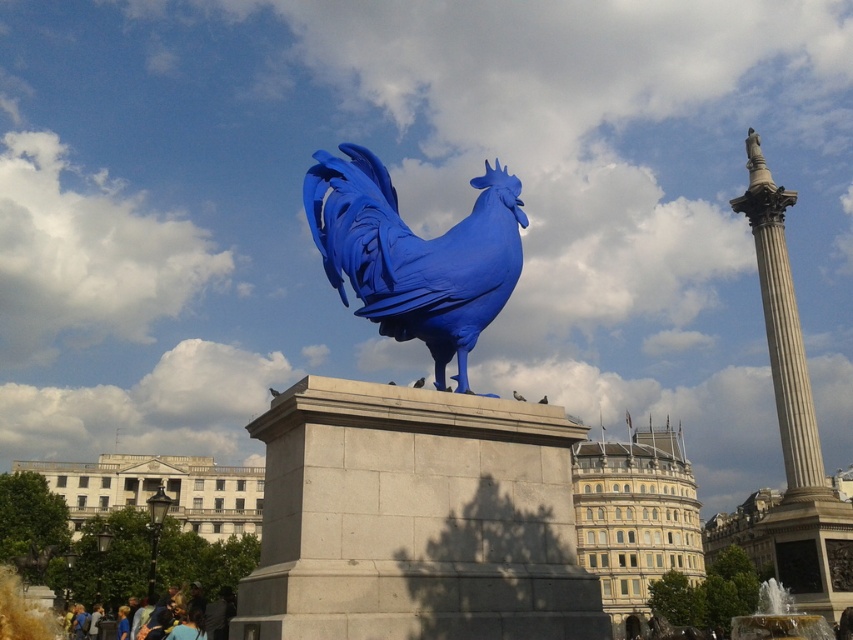
Question: Is matte blue rooster at center wider than marble column at right?

Choices:
 (A) yes
 (B) no

Answer: (A)

Question: Among these objects, which one is farthest from the camera?

Choices:
 (A) matte blue rooster at center
 (B) smooth stone pedestal at center
 (C) marble column at right

Answer: (C)

Question: Does matte blue rooster at center have a lesser width compared to marble column at right?

Choices:
 (A) no
 (B) yes

Answer: (A)

Question: From the image, what is the correct spatial relationship of smooth stone pedestal at center in relation to marble column at right?

Choices:
 (A) right
 (B) left

Answer: (B)

Question: Among these objects, which one is farthest from the camera?

Choices:
 (A) smooth stone pedestal at center
 (B) matte blue rooster at center

Answer: (B)

Question: Considering the real-world distances, which object is closest to the marble column at right?

Choices:
 (A) smooth stone pedestal at center
 (B) matte blue rooster at center

Answer: (A)